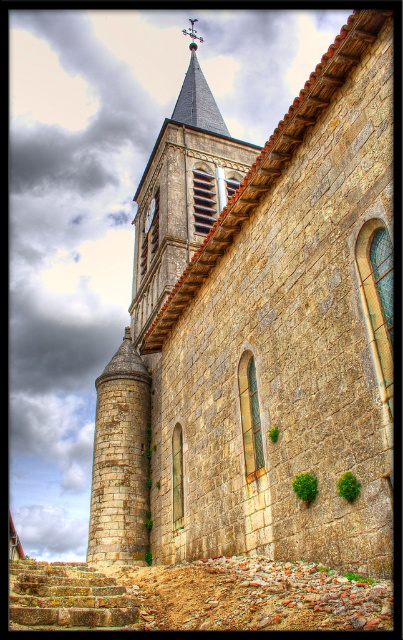
Question: Is stone steeple at upper center below stone textured stairs at lower left?

Choices:
 (A) no
 (B) yes

Answer: (A)

Question: Can you confirm if stone church at center is bigger than stone textured stairs at lower left?

Choices:
 (A) no
 (B) yes

Answer: (B)

Question: Which point is closer to the camera?

Choices:
 (A) coord(199,113)
 (B) coord(147,214)
 (C) coord(272,458)
 (D) coord(108,625)

Answer: (D)

Question: Which point is closer to the camera?

Choices:
 (A) smooth gray steeple at upper center
 (B) stone textured stairs at lower left
 (C) brass clock face at center

Answer: (B)

Question: Does stone textured stairs at lower left have a lesser width compared to smooth gray steeple at upper center?

Choices:
 (A) yes
 (B) no

Answer: (A)

Question: Which point is farther from the camera taking this photo?

Choices:
 (A) (14, 592)
 (B) (184, 499)
 (C) (178, 160)

Answer: (C)